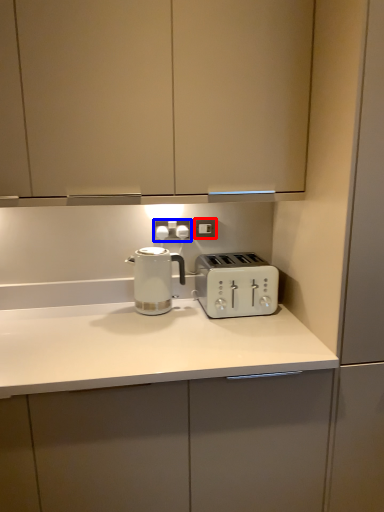
Question: Which of the following is the closest to the observer, electric outlet (highlighted by a red box) or electric outlet (highlighted by a blue box)?

Choices:
 (A) electric outlet
 (B) electric outlet

Answer: (B)